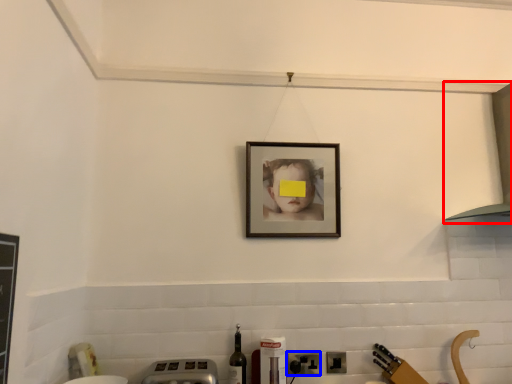
Question: Which object appears farthest to the camera in this image, exhaust hood (highlighted by a red box) or electric outlet (highlighted by a blue box)?

Choices:
 (A) exhaust hood
 (B) electric outlet

Answer: (B)